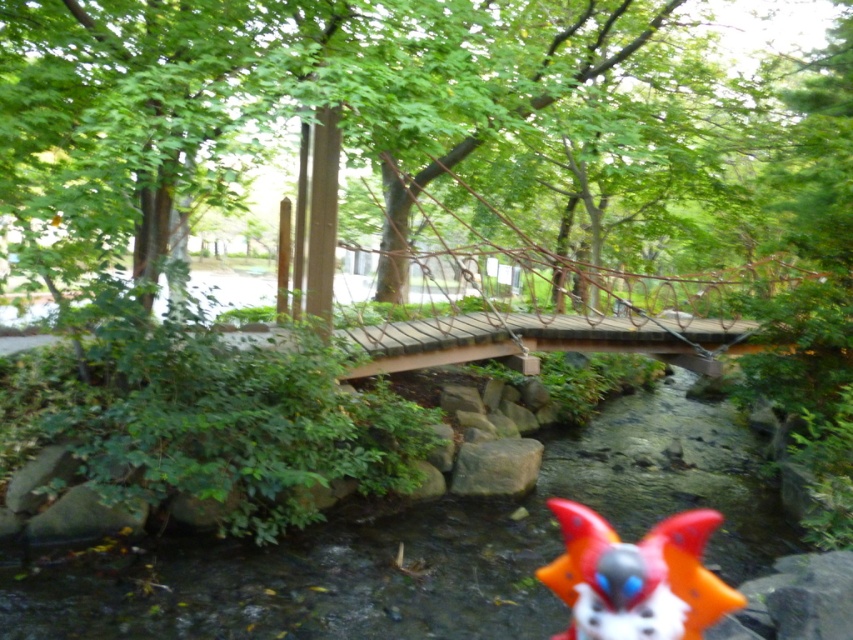
You are standing on the wooden suspension bridge and looking towards the stream. There are two points marked on the bridge, point [685,557] and point [529,468]. Which point is nearer to you?

Point [685,557] is closer to the camera than point [529,468], so the point closer to you is point [685,557].

You are standing on the wooden suspension bridge and want to cross to the other side. There is a point marked at coordinates (425, 547) which is the smooth stone creek at center. Can you step directly onto this point while crossing the bridge?

The point at coordinates (425, 547) is the smooth stone creek at center, which is part of the stream below the bridge. Since the bridge spans over the creek, you cannot step onto the creek itself while crossing the bridge.